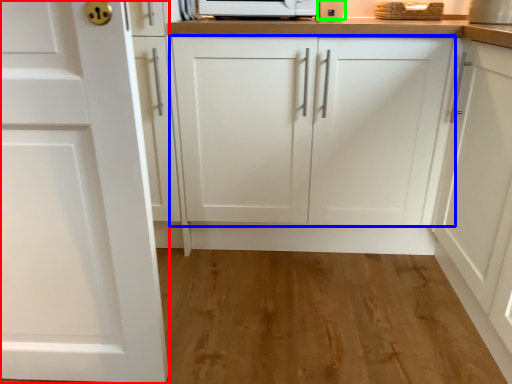
Question: Estimate the real-world distances between objects in this image. Which object is closer to cabinetry (highlighted by a red box), cabinetry (highlighted by a blue box) or appliance (highlighted by a green box)?

Choices:
 (A) cabinetry
 (B) appliance

Answer: (A)